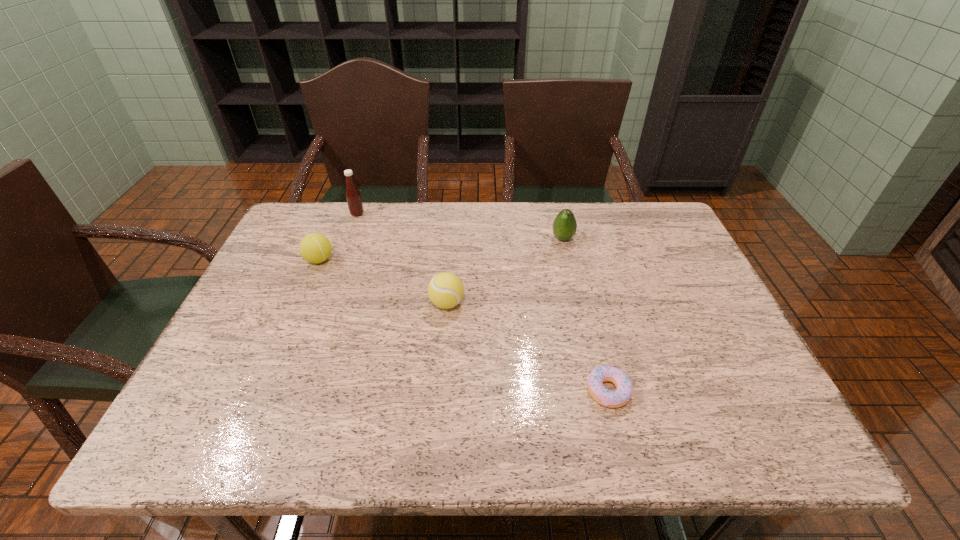
Locate an element on the screen. This screenshot has width=960, height=540. Tabasco sauce is located at coordinates (353, 196).

Identify the location of the farthest object. This screenshot has height=540, width=960. (353, 196).

This screenshot has width=960, height=540. I want to click on avocado, so click(564, 227).

You are a GUI agent. You are given a task and a screenshot of the screen. Output one action in this format:
    pyautogui.click(x=<x>, y=<y>)
    Task: Click on the right tennis ball
    This screenshot has height=540, width=960.
    Given the screenshot: What is the action you would take?
    pyautogui.click(x=445, y=290)

Where is `the third object from right to left`? The image size is (960, 540). the third object from right to left is located at coordinates (445, 290).

The width and height of the screenshot is (960, 540). Identify the location of the third nearest object. (315, 248).

The height and width of the screenshot is (540, 960). Find the location of `the farther tennis ball`. the farther tennis ball is located at coordinates (315, 248).

This screenshot has height=540, width=960. I want to click on doughnut, so click(620, 397).

At what (x,y) coordinates should I click in order to perform the action: click on the nearest object. Please return your answer as a coordinate pair (x, y). This screenshot has height=540, width=960. Looking at the image, I should click on (620, 397).

Where is `vacant space located on the left of the Tabasco sauce`? This screenshot has height=540, width=960. vacant space located on the left of the Tabasco sauce is located at coordinates (334, 214).